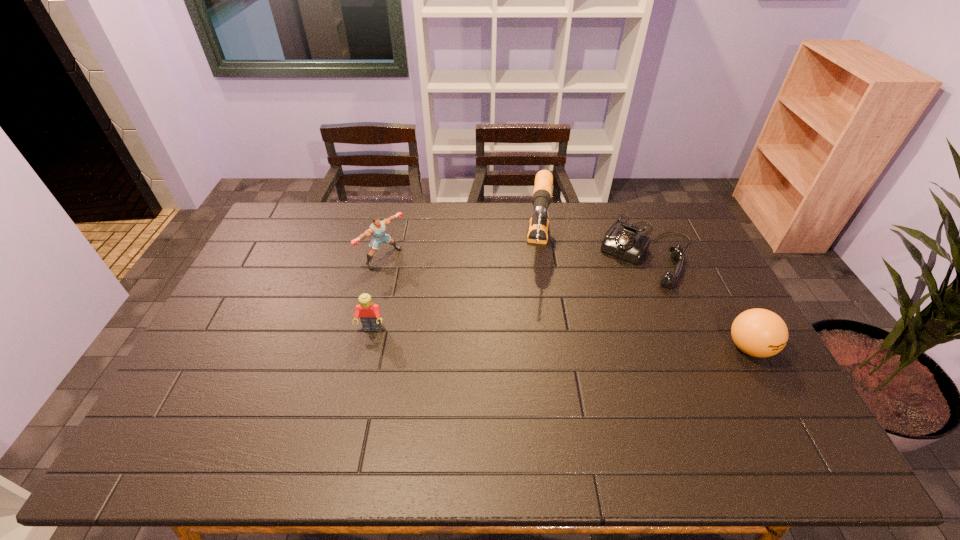
The width and height of the screenshot is (960, 540). What are the coordinates of `vacant space that's between the puncher and the third object from right to left` in the screenshot? It's located at (462, 253).

Where is `free space between the drill and the telephone`? This screenshot has width=960, height=540. free space between the drill and the telephone is located at coordinates (593, 249).

The height and width of the screenshot is (540, 960). What are the coordinates of `empty location between the Lego and the third object from right to left` in the screenshot? It's located at (456, 288).

Where is `vacant area that lies between the Lego and the drill`? vacant area that lies between the Lego and the drill is located at coordinates (456, 288).

The height and width of the screenshot is (540, 960). Identify the location of unoccupied position between the telephone and the Lego. tap(509, 289).

Find the location of `free space between the ping-pong ball and the tallest object`. free space between the ping-pong ball and the tallest object is located at coordinates (644, 298).

Locate an element on the screen. This screenshot has height=540, width=960. unoccupied position between the ping-pong ball and the tallest object is located at coordinates (644, 298).

At what (x,y) coordinates should I click in order to perform the action: click on free space between the ping-pong ball and the telephone. Please return your answer as a coordinate pair (x, y). This screenshot has height=540, width=960. Looking at the image, I should click on (698, 299).

This screenshot has width=960, height=540. What are the coordinates of `vacant area between the Lego and the fourth shortest object` in the screenshot? It's located at (377, 293).

At what (x,y) coordinates should I click in order to perform the action: click on object that is the fourth closest to the Lego. Please return your answer as a coordinate pair (x, y). The height and width of the screenshot is (540, 960). Looking at the image, I should click on (758, 332).